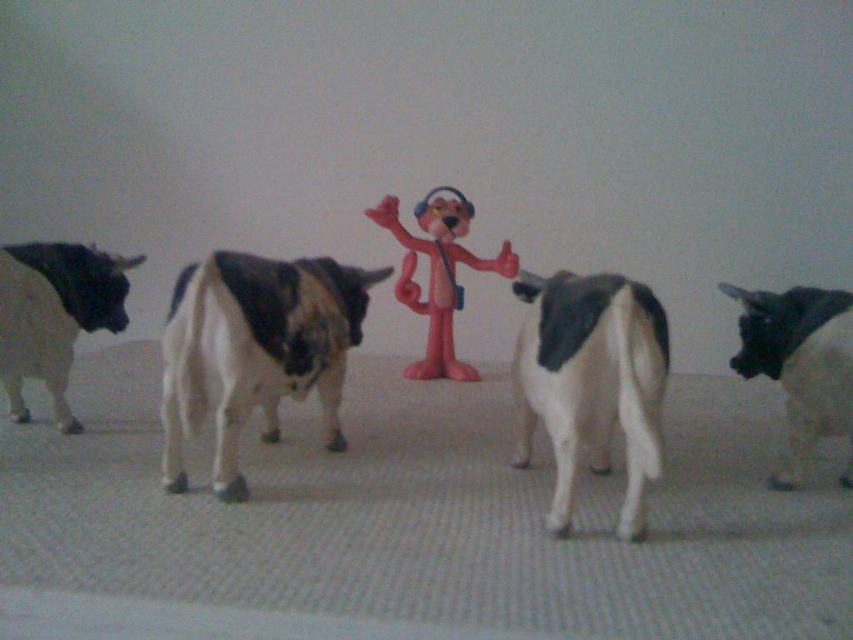
You are a toy cow that wants to move from your current position to the other cow. The path is clear. Can you walk directly to the black and white plastic cow at left from the black and white plastic cow at center without needing to go around anything?

The distance between the black and white plastic cow at center and the black and white plastic cow at left is 27.82 inches, so yes, you can walk directly to the black and white plastic cow at left from the black and white plastic cow at center since the path is clear and there are no obstacles mentioned in the scene description.

You are a child playing with toys in the room. You have the black and white plastic cow at center and the black glossy bull at right. Which toy is closer to the Pink Panther figurine?

The black and white plastic cow at center is closer to the Pink Panther figurine because it is positioned to the left of the black glossy bull at right, which is further away.

You are standing at the center of the room and see the black and white plastic cow at center. What are the coordinates of the cow?

The coordinates of the black and white plastic cow at center are at point (592, 384).